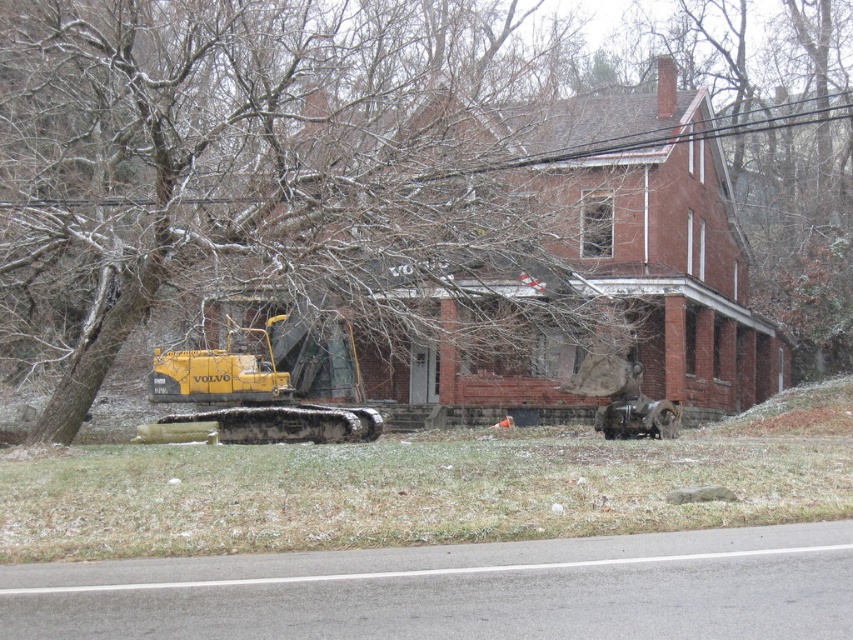
You are standing at the point marked as point (241, 20), which is 18.86 meters away from the viewer. Can you confirm if this point is located in front of the red brick house?

The point (241, 20) is 18.86 meters from the viewer, but without additional spatial data about the house location relative to the viewer, I cannot determine if it is in front of the house.

You are standing at the point closest to the yellow Volvo excavator. There are two points marked in the image, one at coordinates point (143, 237) and the other at point (260, 412). Which point is closer to you?

Point (143, 237) is in front of point (260, 412), so if you are standing at the point closest to the yellow Volvo excavator, point (143, 237) is closer to you.